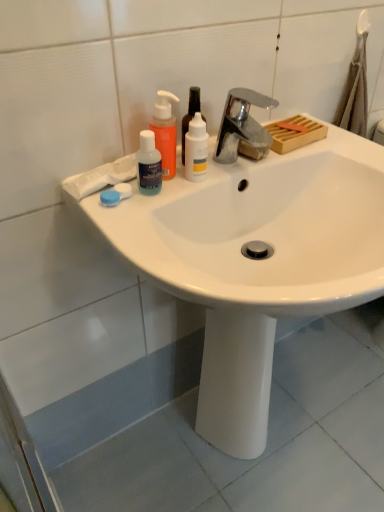
Question: Considering the relative positions of translucent orange pump bottle at upper left and white glossy bottle at center, the third mouthwash in the left-to-right sequence, in the image provided, is translucent orange pump bottle at upper left to the left or to the right of white glossy bottle at center, the third mouthwash in the left-to-right sequence,?

Choices:
 (A) right
 (B) left

Answer: (B)

Question: From a real-world perspective, is translucent orange pump bottle at upper left above or below white glossy bottle at center, arranged as the first mouthwash when viewed from the right?

Choices:
 (A) below
 (B) above

Answer: (B)

Question: Which object is positioned closest to the white glossy sink at center?

Choices:
 (A) blue plastic contact lens case at left
 (B) translucent plastic mouthwash at upper left, positioned as the 3th mouthwash in right-to-left order
 (C) chrome metallic faucet at upper center
 (D) white glossy bottle at center, marked as the 2th mouthwash in a left-to-right arrangement
 (E) white glossy bottle at center, the third mouthwash in the left-to-right sequence

Answer: (C)

Question: Estimate the real-world distances between objects in this image. Which object is farther from the chrome metallic faucet at upper center?

Choices:
 (A) white glossy bottle at center, marked as the 2th mouthwash in a left-to-right arrangement
 (B) white glossy bottle at center, the third mouthwash in the left-to-right sequence
 (C) blue plastic contact lens case at left
 (D) translucent orange pump bottle at upper left
 (E) translucent plastic mouthwash at upper left, arranged as the first mouthwash when viewed from the left

Answer: (C)